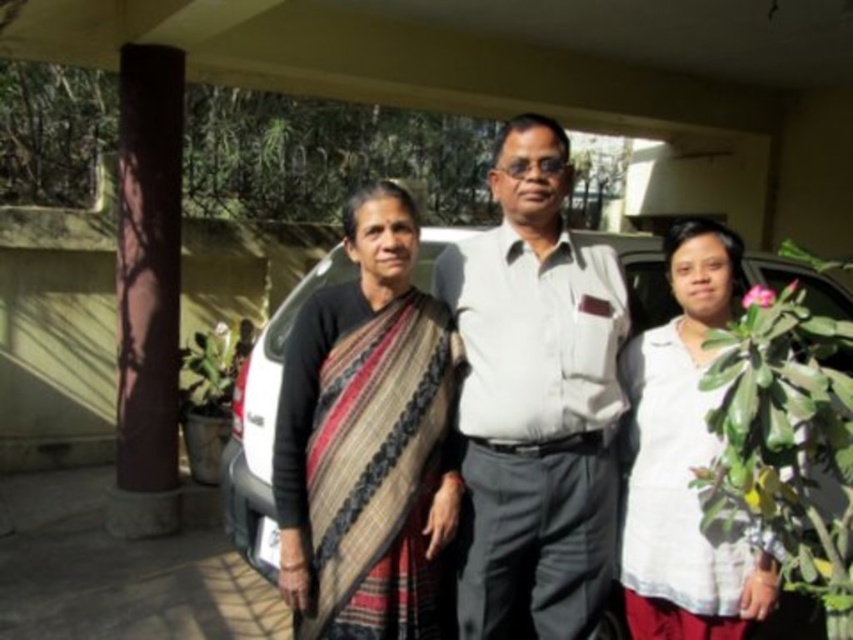
You are a photographer trying to focus on the white smooth shirt at center. According to the coordinates provided, where should you adjust your camera to aim precisely?

You should aim your camera at the coordinates point (x=535, y=400) to focus on the white smooth shirt at center.

You are a photographer trying to capture the striped fabric saree at center and the white matte car at center in a single shot. Based on their positions, can you determine which one is closer to the camera?

The striped fabric saree at center is above the white matte car at center, so it is closer to the camera.